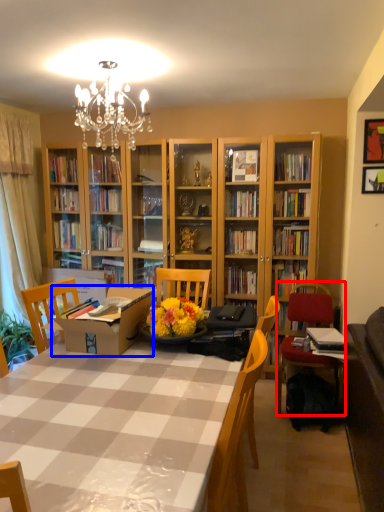
Question: Which of the following is the farthest to the observer, chair (highlighted by a red box) or cardboard box (highlighted by a blue box)?

Choices:
 (A) chair
 (B) cardboard box

Answer: (A)